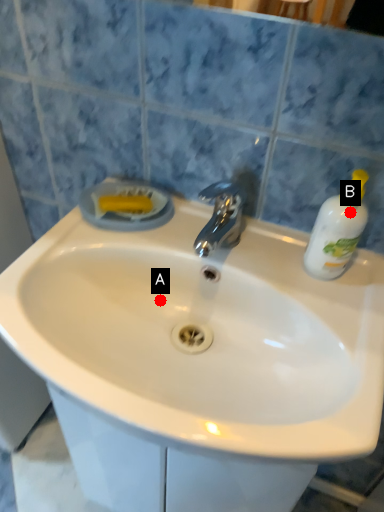
Question: Two points are circled on the image, labeled by A and B beside each circle. Which point is further to the camera?

Choices:
 (A) A is further
 (B) B is further

Answer: (A)